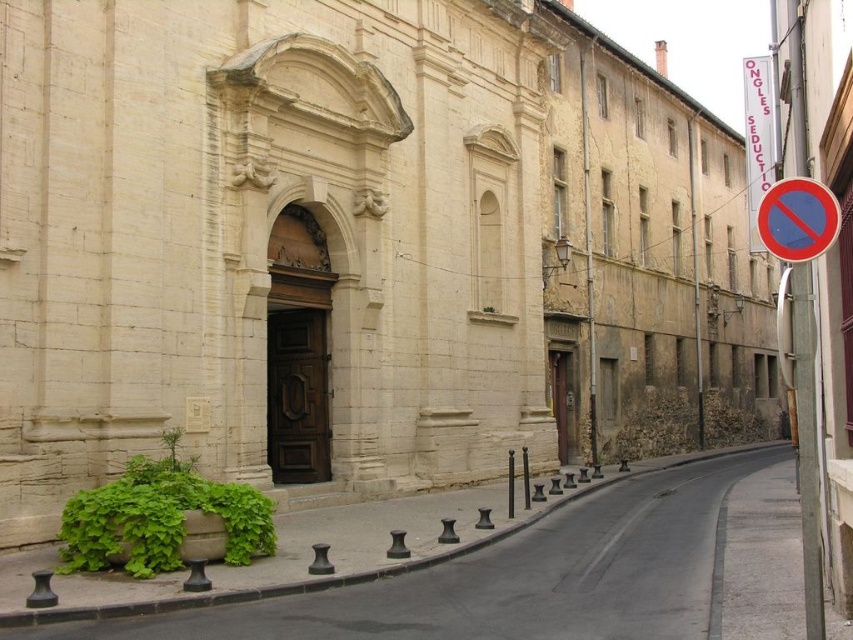
Question: Which object is closer to the camera taking this photo?

Choices:
 (A) green leafy plant at lower left
 (B) red plastic sign at right

Answer: (B)

Question: Considering the relative positions of green leafy plant at lower left and red plastic sign at right in the image provided, where is green leafy plant at lower left located with respect to red plastic sign at right?

Choices:
 (A) below
 (B) above

Answer: (A)

Question: Is green leafy plant at lower left positioned in front of red plastic sign at right?

Choices:
 (A) no
 (B) yes

Answer: (A)

Question: Does green leafy plant at lower left lie behind red plastic sign at right?

Choices:
 (A) yes
 (B) no

Answer: (A)